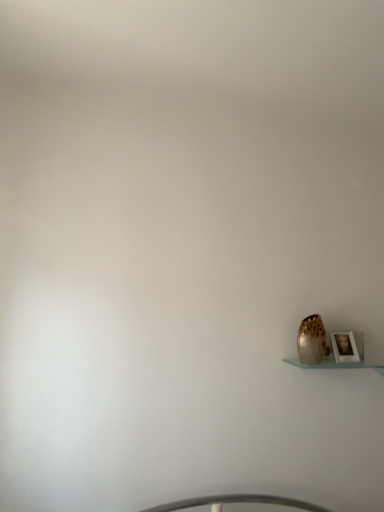
Question: Are wooden photo frame at lower right and speckled ceramic vase at lower right located far from each other?

Choices:
 (A) yes
 (B) no

Answer: (B)

Question: Does wooden photo frame at lower right have a greater width compared to speckled ceramic vase at lower right?

Choices:
 (A) yes
 (B) no

Answer: (B)

Question: Would you say speckled ceramic vase at lower right is part of wooden photo frame at lower right's contents?

Choices:
 (A) no
 (B) yes

Answer: (A)

Question: Is wooden photo frame at lower right facing away from speckled ceramic vase at lower right?

Choices:
 (A) no
 (B) yes

Answer: (A)

Question: Is wooden photo frame at lower right positioned behind speckled ceramic vase at lower right?

Choices:
 (A) no
 (B) yes

Answer: (B)

Question: Could you tell me if wooden photo frame at lower right is turned towards speckled ceramic vase at lower right?

Choices:
 (A) no
 (B) yes

Answer: (A)

Question: Does speckled ceramic vase at lower right contain wooden photo frame at lower right?

Choices:
 (A) yes
 (B) no

Answer: (B)

Question: Can you confirm if speckled ceramic vase at lower right is thinner than wooden photo frame at lower right?

Choices:
 (A) yes
 (B) no

Answer: (B)

Question: Is speckled ceramic vase at lower right wider than wooden photo frame at lower right?

Choices:
 (A) no
 (B) yes

Answer: (B)

Question: Considering the relative positions of speckled ceramic vase at lower right and wooden photo frame at lower right in the image provided, is speckled ceramic vase at lower right behind wooden photo frame at lower right?

Choices:
 (A) no
 (B) yes

Answer: (A)

Question: From the image's perspective, is speckled ceramic vase at lower right beneath wooden photo frame at lower right?

Choices:
 (A) no
 (B) yes

Answer: (A)

Question: Can you confirm if speckled ceramic vase at lower right is positioned to the right of wooden photo frame at lower right?

Choices:
 (A) no
 (B) yes

Answer: (A)

Question: Is point (349, 333) closer or farther from the camera than point (317, 357)?

Choices:
 (A) farther
 (B) closer

Answer: (A)